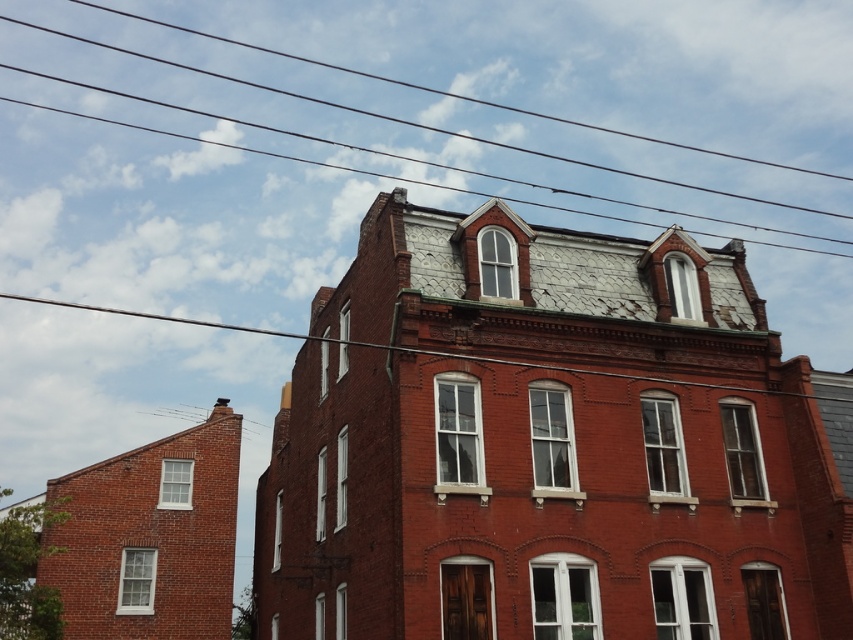
You are a window cleaner standing on a ladder looking at the building. You need to clean the black wire at upper center and the metallic wire at upper center. Which wire do you need to reach higher to clean?

The black wire at upper center is much taller than the metallic wire at upper center, so you need to reach higher to clean the black wire at upper center.

You are standing in front of the two story brick building. There is a black wire at upper center represented by point (418, 122). Can you see the black wire at upper center from the ground floor?

Yes, the black wire at upper center represented by point (418, 122) is visible from the ground floor as it is located at the upper center of the building.

You are an electrician working on the building. You need to locate the black wire at upper center. According to the coordinates provided, where exactly would you find it?

The black wire at upper center is located at point coordinates of (418, 122).